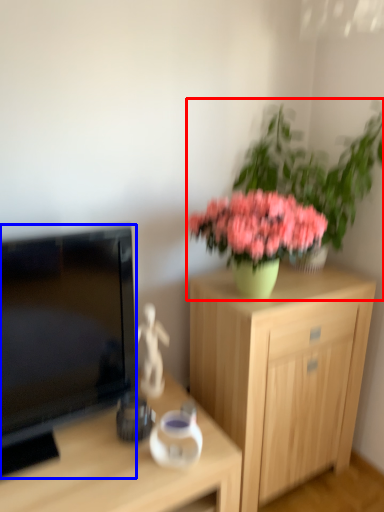
Question: Among these objects, which one is farthest to the camera, houseplant (highlighted by a red box) or television (highlighted by a blue box)?

Choices:
 (A) houseplant
 (B) television

Answer: (A)